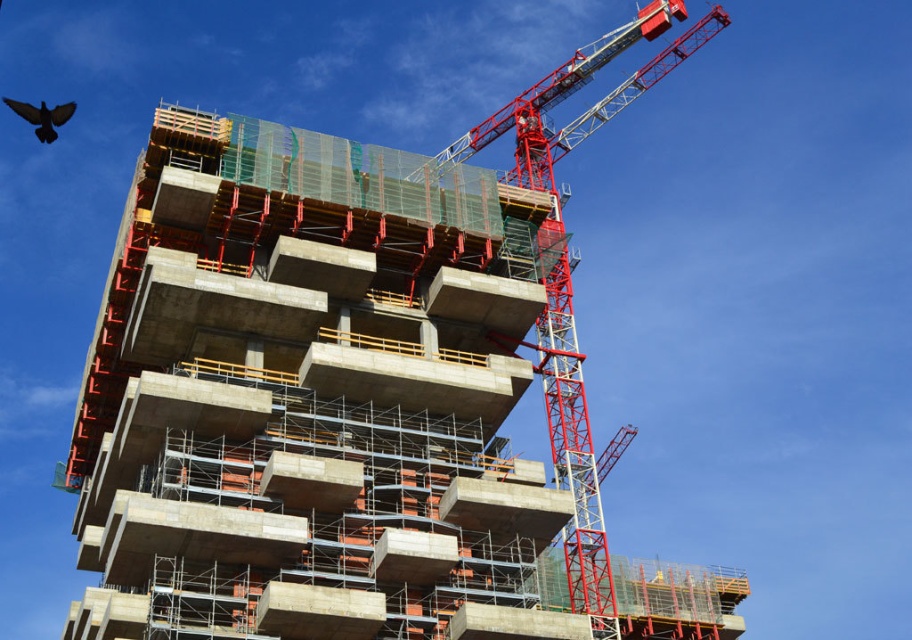
Which is more to the right, concrete at center or black feathered bird at upper left?

concrete at center is more to the right.

Between concrete at center and black feathered bird at upper left, which one has more height?

Standing taller between the two is concrete at center.

Is point (527, 595) in front of point (52, 118)?

Yes, it is in front of point (52, 118).

Where is `concrete at center`? This screenshot has width=912, height=640. concrete at center is located at coordinates (309, 397).

Is concrete at center taller than metallic red crane at upper right?

No.

Is point (183, 464) behind point (566, 563)?

That is False.

Where is `concrete at center`? The width and height of the screenshot is (912, 640). concrete at center is located at coordinates (309, 397).

Does metallic red crane at upper right lie in front of black feathered bird at upper left?

Yes, it is in front of black feathered bird at upper left.

Who is taller, metallic red crane at upper right or black feathered bird at upper left?

metallic red crane at upper right is taller.

What are the coordinates of `metallic red crane at upper right` in the screenshot? It's located at (572, 442).

I want to click on metallic red crane at upper right, so click(572, 442).